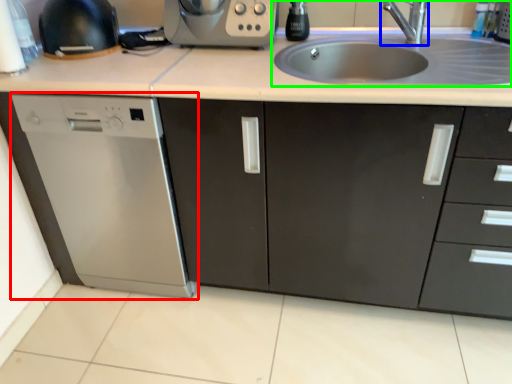
Question: Based on their relative distances, which object is nearer to home appliance (highlighted by a red box)? Choose from tap (highlighted by a blue box) and sink (highlighted by a green box).

Choices:
 (A) tap
 (B) sink

Answer: (B)